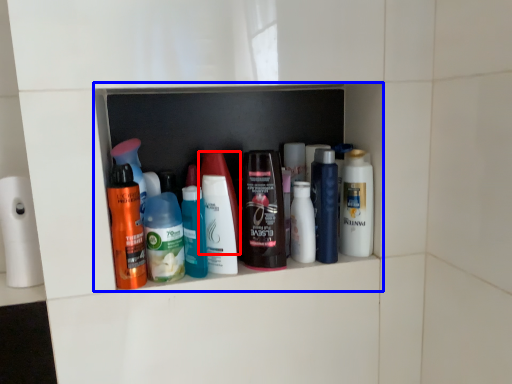
Question: Which of the following is the farthest to the observer, toiletry (highlighted by a red box) or shelf (highlighted by a blue box)?

Choices:
 (A) toiletry
 (B) shelf

Answer: (B)